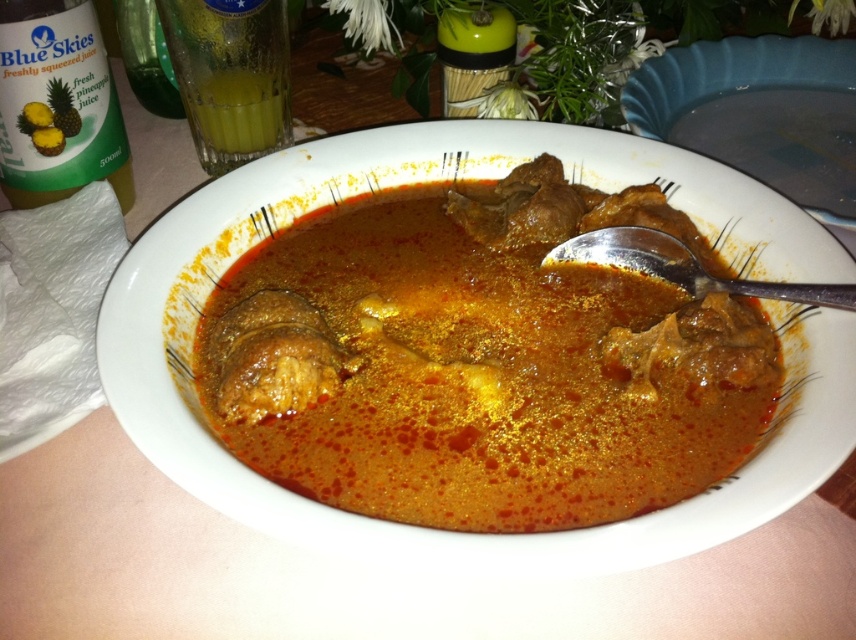
Is brown matte stew at center wider than silver metallic spoon at upper right?

Correct, the width of brown matte stew at center exceeds that of silver metallic spoon at upper right.

Is point (749, 403) farther from camera compared to point (697, 275)?

That is False.

Between point (431, 362) and point (629, 246), which one is positioned behind?

The point (629, 246) is behind.

Locate an element on the screen. The height and width of the screenshot is (640, 856). brown matte stew at center is located at coordinates (486, 376).

Describe the element at coordinates (230, 76) in the screenshot. I see `green translucent glass at upper left` at that location.

Can you confirm if green translucent glass at upper left is bigger than silver metallic spoon at upper right?

Correct, green translucent glass at upper left is larger in size than silver metallic spoon at upper right.

Identify the location of green translucent glass at upper left. The width and height of the screenshot is (856, 640). (230, 76).

Does brown matte stew at center have a lesser height compared to translucent glass at upper left?

No.

Is brown matte stew at center closer to camera compared to translucent glass at upper left?

Yes, it is in front of translucent glass at upper left.

Does point (767, 400) come in front of point (226, 100)?

Yes, it is in front of point (226, 100).

Where is `brown matte stew at center`? Image resolution: width=856 pixels, height=640 pixels. brown matte stew at center is located at coordinates (486, 376).